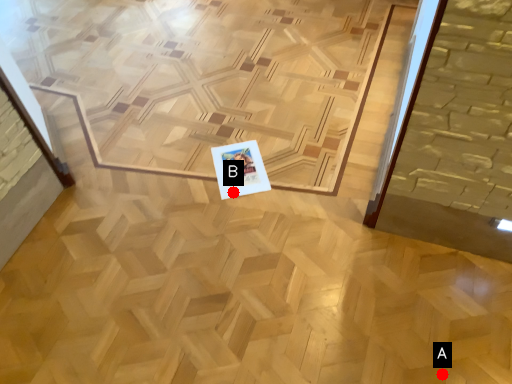
Question: Two points are circled on the image, labeled by A and B beside each circle. Which point is closer to the camera taking this photo?

Choices:
 (A) A is closer
 (B) B is closer

Answer: (A)